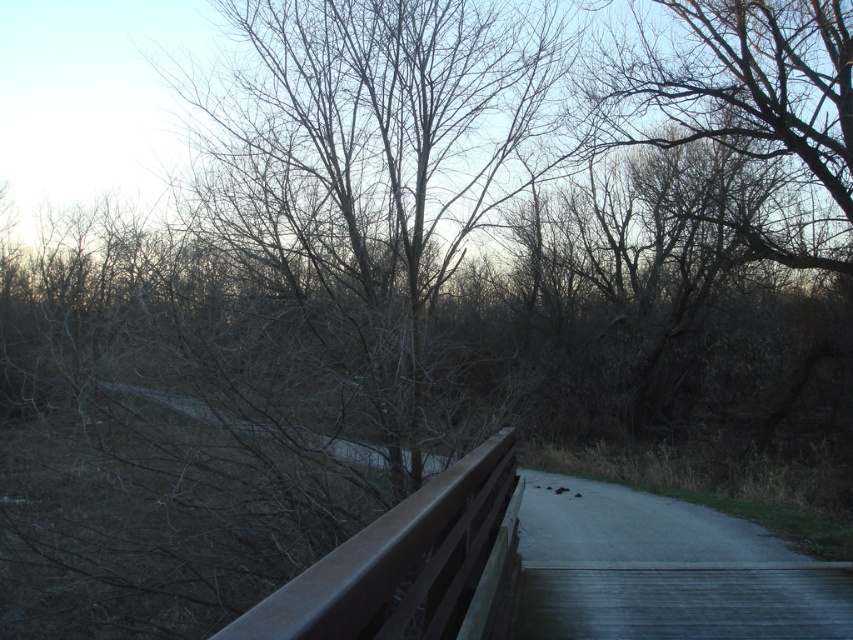
Can you confirm if bare branches at center is smaller than metallic brown railing at center?

Correct, bare branches at center occupies less space than metallic brown railing at center.

Is point (396, 179) farther from camera compared to point (457, 564)?

Yes, it is.

Between point (328, 102) and point (440, 632), which one is positioned in front?

Point (440, 632)

In order to click on bare branches at center in this screenshot , I will do `click(375, 170)`.